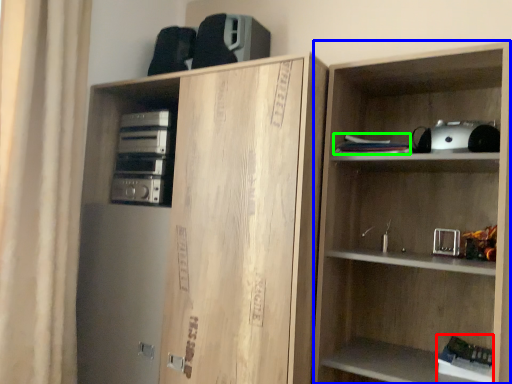
Question: Which object is the closest to the book (highlighted by a red box)? Choose among these: shelf (highlighted by a blue box) or book (highlighted by a green box).

Choices:
 (A) shelf
 (B) book

Answer: (A)